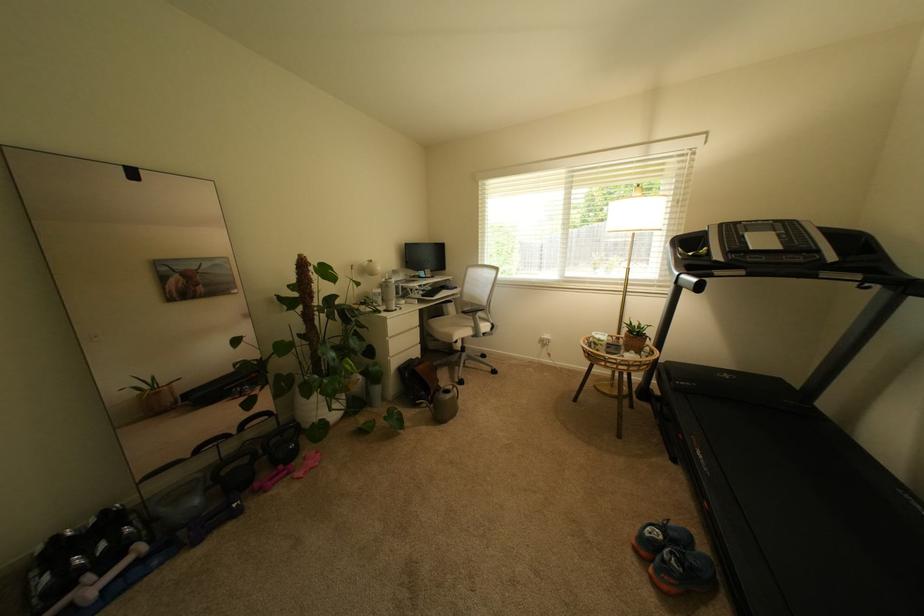
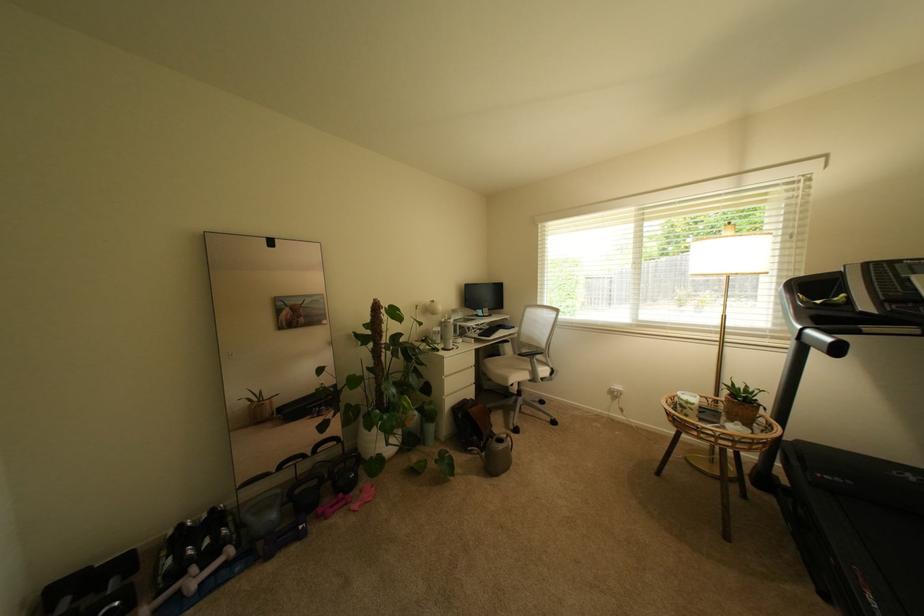
In the second image, find the point that corresponds to [64,540] in the first image.

(188, 527)